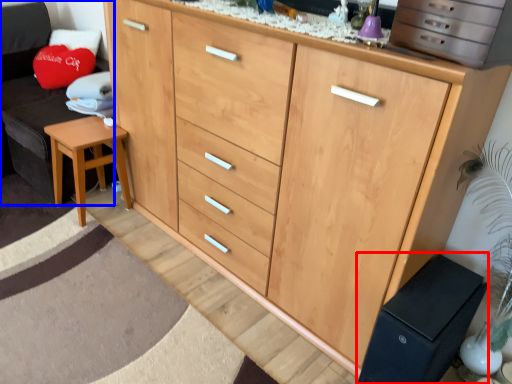
Question: Which object appears farthest to the camera in this image, changing table (highlighted by a red box) or swivel chair (highlighted by a blue box)?

Choices:
 (A) changing table
 (B) swivel chair

Answer: (B)